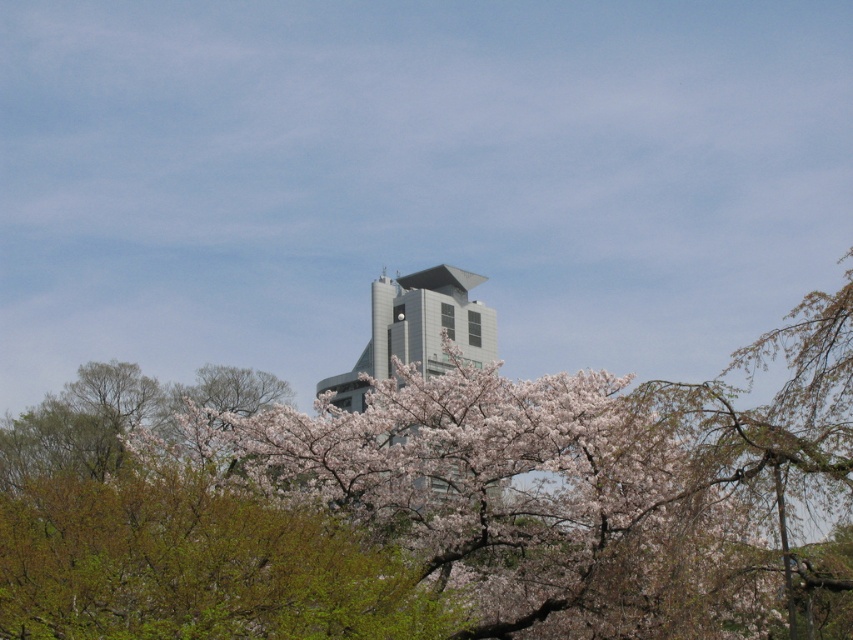
Does pink blossoms at center come behind gray metallic building at center?

No.

Locate an element on the screen. pink blossoms at center is located at coordinates (521, 499).

This screenshot has height=640, width=853. I want to click on pink blossoms at center, so click(521, 499).